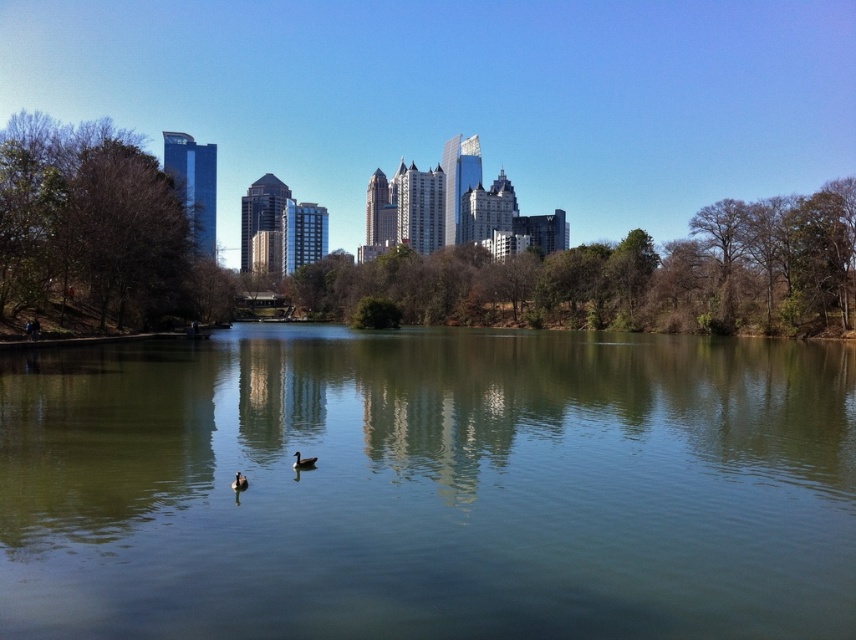
Who is lower down, brown matte duck at center or brown matte duck at lower center?

brown matte duck at lower center is below.

Who is positioned more to the right, brown matte duck at center or brown matte duck at lower center?

brown matte duck at center

Describe the element at coordinates (302, 461) in the screenshot. This screenshot has height=640, width=856. I see `brown matte duck at center` at that location.

This screenshot has width=856, height=640. I want to click on brown matte duck at center, so click(x=302, y=461).

Which is below, green smooth water at center or brown matte duck at center?

Positioned lower is brown matte duck at center.

Can you confirm if green smooth water at center is thinner than brown matte duck at center?

Incorrect, green smooth water at center's width is not less than brown matte duck at center's.

Is point (80, 589) positioned behind point (305, 460)?

No.

This screenshot has width=856, height=640. What are the coordinates of `green smooth water at center` in the screenshot? It's located at (429, 486).

How much distance is there between green smooth water at center and brown matte duck at lower center?

green smooth water at center is 23.66 meters from brown matte duck at lower center.

Is green smooth water at center to the right of brown matte duck at lower center from the viewer's perspective?

Indeed, green smooth water at center is positioned on the right side of brown matte duck at lower center.

Does point (792, 632) come behind point (239, 486)?

No.

At what (x,y) coordinates should I click in order to perform the action: click on green smooth water at center. Please return your answer as a coordinate pair (x, y). This screenshot has height=640, width=856. Looking at the image, I should click on (429, 486).